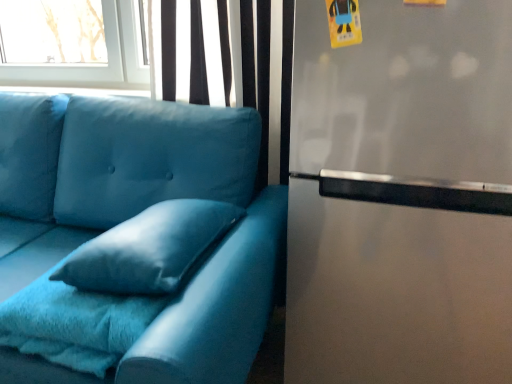
Question: Does velvet blue pillow at center appear on the left side of stainless steel fridge at right?

Choices:
 (A) yes
 (B) no

Answer: (A)

Question: Is stainless steel fridge at right at the back of velvet blue pillow at center?

Choices:
 (A) no
 (B) yes

Answer: (A)

Question: From the image's perspective, does velvet blue pillow at center appear lower than stainless steel fridge at right?

Choices:
 (A) no
 (B) yes

Answer: (B)

Question: Does velvet blue pillow at center have a larger size compared to stainless steel fridge at right?

Choices:
 (A) no
 (B) yes

Answer: (A)

Question: Does velvet blue pillow at center have a smaller size compared to stainless steel fridge at right?

Choices:
 (A) no
 (B) yes

Answer: (B)

Question: Relative to velvet blue pillow at center, is stainless steel fridge at right in front or behind?

Choices:
 (A) front
 (B) behind

Answer: (A)

Question: Is stainless steel fridge at right to the left or to the right of velvet blue pillow at center in the image?

Choices:
 (A) left
 (B) right

Answer: (B)

Question: Looking at their shapes, would you say stainless steel fridge at right is wider or thinner than velvet blue pillow at center?

Choices:
 (A) wide
 (B) thin

Answer: (A)

Question: From the image's perspective, is stainless steel fridge at right positioned above or below velvet blue pillow at center?

Choices:
 (A) above
 (B) below

Answer: (A)

Question: From the image's perspective, is velvet blue pillow at center located above or below stainless steel fridge at right?

Choices:
 (A) above
 (B) below

Answer: (B)

Question: From a real-world perspective, relative to stainless steel fridge at right, is velvet blue pillow at center vertically above or below?

Choices:
 (A) below
 (B) above

Answer: (B)

Question: In the image, is velvet blue pillow at center positioned in front of or behind stainless steel fridge at right?

Choices:
 (A) front
 (B) behind

Answer: (B)

Question: In terms of width, does velvet blue pillow at center look wider or thinner when compared to stainless steel fridge at right?

Choices:
 (A) thin
 (B) wide

Answer: (A)

Question: Considering the positions of matte blue fabric couch at left and stainless steel fridge at right in the image, is matte blue fabric couch at left wider or thinner than stainless steel fridge at right?

Choices:
 (A) thin
 (B) wide

Answer: (B)

Question: Visually, is matte blue fabric couch at left positioned to the left or to the right of stainless steel fridge at right?

Choices:
 (A) right
 (B) left

Answer: (B)